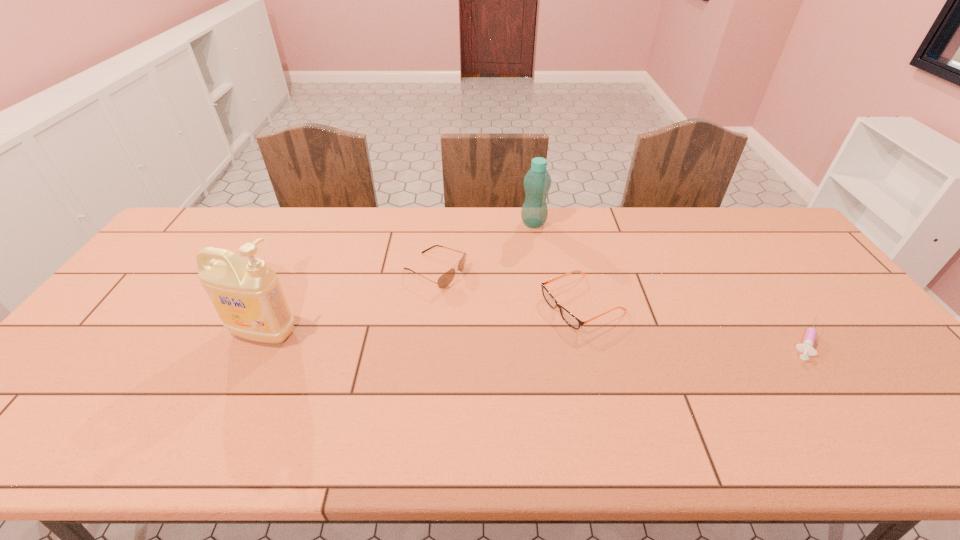
Identify the location of object that is at the far edge. (537, 182).

I want to click on object located in the right edge section of the desktop, so click(x=807, y=347).

Where is `vacant point at the far edge`? vacant point at the far edge is located at coordinates (675, 238).

I want to click on vacant space at the near edge, so click(612, 387).

This screenshot has height=540, width=960. In the image, there is a desktop. Identify the location of free space at the right edge. (839, 341).

You are a GUI agent. You are given a task and a screenshot of the screen. Output one action in this format:
    pyautogui.click(x=<x>, y=<y>)
    Task: Click on the vacant area at the near left corner of the desktop
    The image size is (960, 540).
    Given the screenshot: What is the action you would take?
    pyautogui.click(x=54, y=402)

I want to click on vacant area that lies between the water bottle and the shortest object, so click(670, 281).

The image size is (960, 540). I want to click on free area in between the syringe and the detergent, so click(536, 336).

Where is `vacant area between the second shortest object and the second object from left to right`? This screenshot has height=540, width=960. vacant area between the second shortest object and the second object from left to right is located at coordinates (509, 287).

Locate an element on the screen. free space that is in between the rightmost object and the leftmost object is located at coordinates (536, 336).